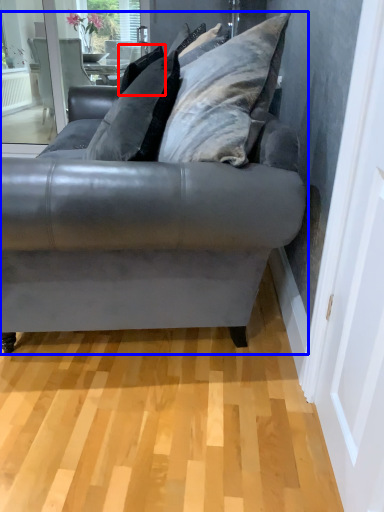
Question: Among these objects, which one is farthest to the camera, pillow (highlighted by a red box) or studio couch (highlighted by a blue box)?

Choices:
 (A) pillow
 (B) studio couch

Answer: (A)